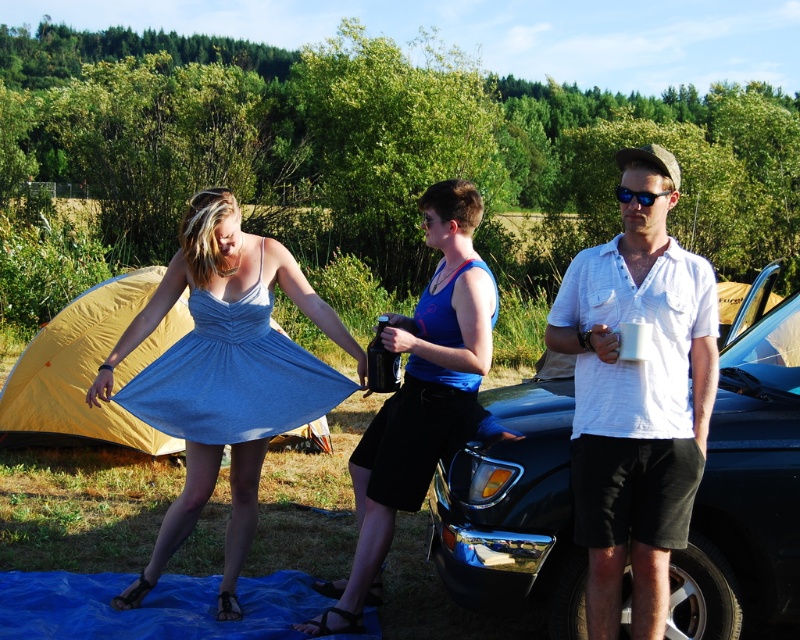
Question: Does shiny blue car at center appear under white cotton shirt at center?

Choices:
 (A) yes
 (B) no

Answer: (A)

Question: Considering the relative positions of shiny blue car at center and matte blue dress at center in the image provided, where is shiny blue car at center located with respect to matte blue dress at center?

Choices:
 (A) left
 (B) right

Answer: (B)

Question: Which of the following is the closest to the observer?

Choices:
 (A) (370, 548)
 (B) (164, 616)
 (C) (624, 246)
 (D) (194, 266)

Answer: (C)

Question: Does shiny blue car at center appear over blue tarp at lower center?

Choices:
 (A) yes
 (B) no

Answer: (A)

Question: Which object is farther from the camera taking this photo?

Choices:
 (A) shiny blue car at center
 (B) blue fabric dress at center

Answer: (B)

Question: Among these points, which one is nearest to the camera?

Choices:
 (A) (x=660, y=328)
 (B) (x=90, y=632)
 (C) (x=212, y=365)
 (D) (x=462, y=436)

Answer: (A)